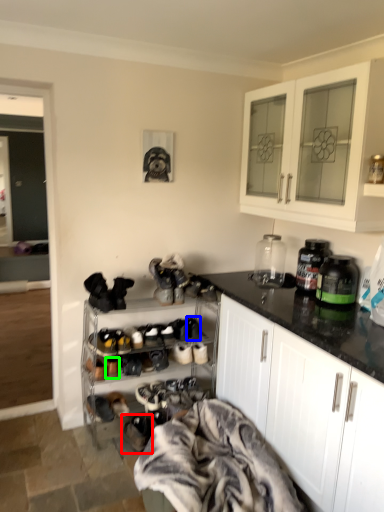
Question: Which object is positioned farthest from footwear (highlighted by a red box)? Select from shoe (highlighted by a blue box) and shoe (highlighted by a green box).

Choices:
 (A) shoe
 (B) shoe

Answer: (A)